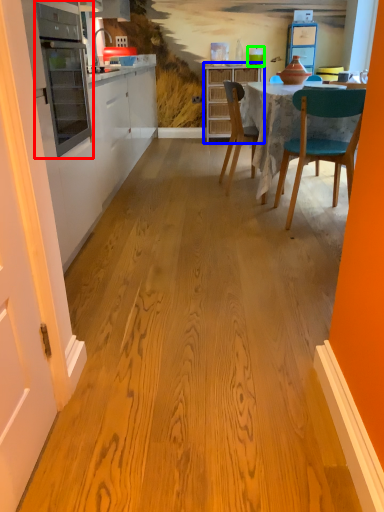
Question: Estimate the real-world distances between objects in this image. Which object is closer to appliance (highlighted by a red box), cabinetry (highlighted by a blue box) or teal (highlighted by a green box)?

Choices:
 (A) cabinetry
 (B) teal

Answer: (A)